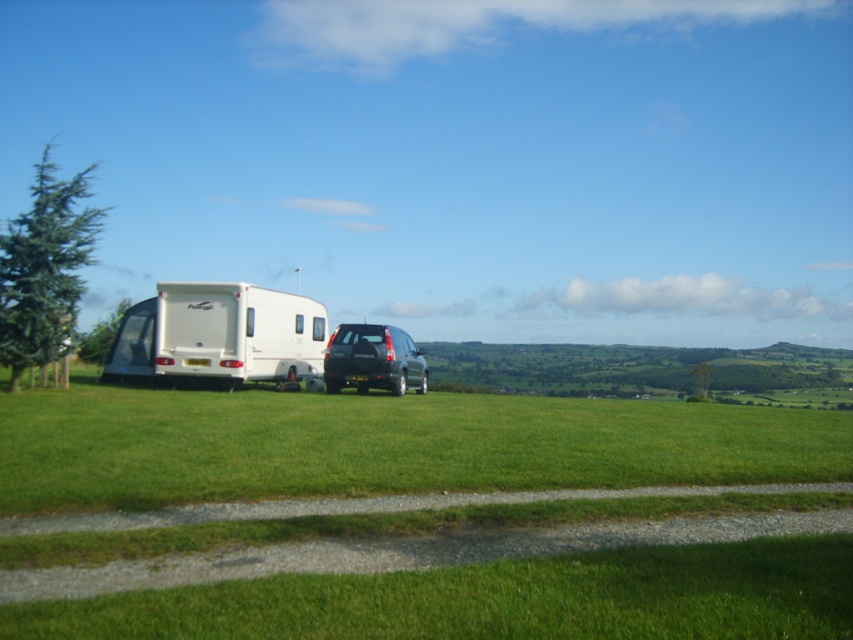
You are a delivery person who needs to place a package on the ground between the satin black suv at center and the black plastic license plate at center. The package requires 2 feet of space to be safely placed. Is there enough space between them?

The satin black suv at center and the black plastic license plate at center are 3.89 feet apart, which is more than the required 2 feet of space. Therefore, there is enough space to safely place the package between them.

You are a delivery person trying to deliver a package to the white glossy camper at left. However, you notice the black plastic license plate at center. Can you determine if the license plate is visible from the front of the camper?

The white glossy camper at left is positioned over the black plastic license plate at center, so the license plate is not visible from the front of the camper.